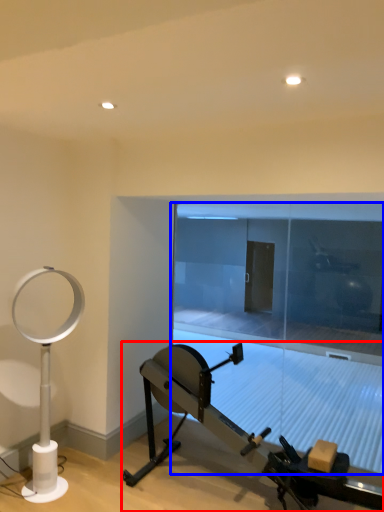
Question: Which object is further to the camera taking this photo, stationary bicycle (highlighted by a red box) or glass door (highlighted by a blue box)?

Choices:
 (A) stationary bicycle
 (B) glass door

Answer: (B)